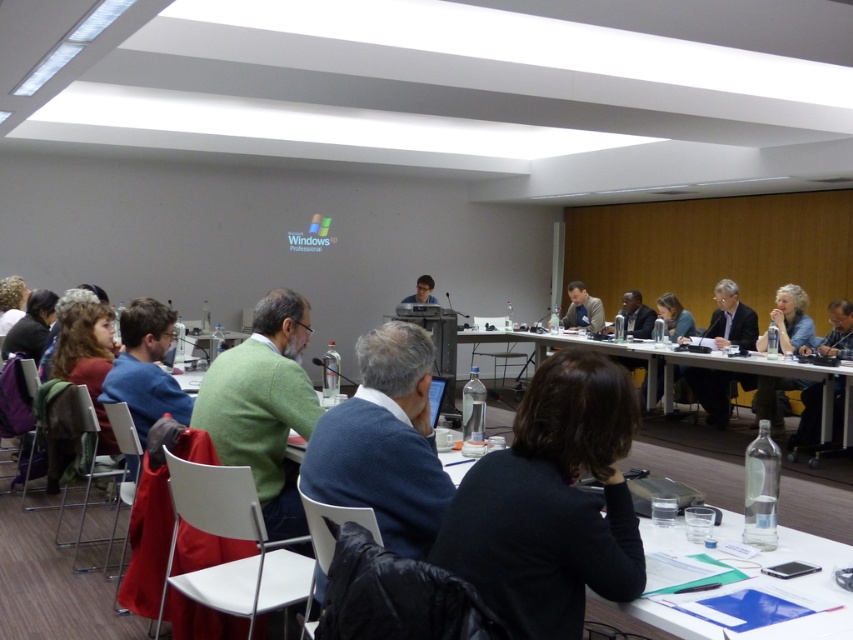
Which is behind, point (366, 442) or point (683, 314)?

Positioned behind is point (683, 314).

Is point (347, 410) less distant than point (666, 314)?

Yes, it is.

This screenshot has width=853, height=640. What do you see at coordinates (384, 442) in the screenshot?
I see `blue sweater at center` at bounding box center [384, 442].

The height and width of the screenshot is (640, 853). I want to click on blue sweater at center, so click(x=384, y=442).

You are a GUI agent. You are given a task and a screenshot of the screen. Output one action in this format:
    pyautogui.click(x=<x>, y=<y>)
    Task: Click on the black fabric jacket at center
    The width and height of the screenshot is (853, 640).
    Given the screenshot: What is the action you would take?
    coord(550,502)

Find the location of a particular element. black fabric jacket at center is located at coordinates (550, 502).

I want to click on black fabric jacket at center, so click(x=550, y=502).

Is blue denim jacket at right thinner than light brown leather jacket at center?

No, blue denim jacket at right is not thinner than light brown leather jacket at center.

Between point (786, 378) and point (576, 321), which one is positioned in front?

Point (786, 378) is in front.

Measure the distance between blue denim jacket at right and camera.

6.01 meters

Find the location of a particular element. The width and height of the screenshot is (853, 640). blue denim jacket at right is located at coordinates (791, 317).